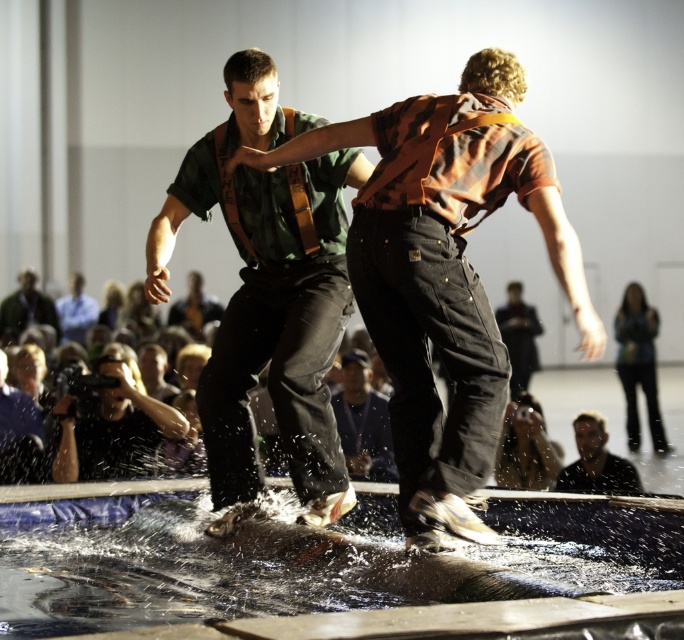
Is clear liquid water at center positioned behind orange cotton shirt at center?

No, clear liquid water at center is closer to the viewer.

Between point (586, 586) and point (434, 156), which one is positioned in front?

Point (434, 156)

Where is `clear liquid water at center`? clear liquid water at center is located at coordinates (330, 564).

Who is positioned more to the left, orange cotton shirt at center or smooth skin face at lower right?

From the viewer's perspective, orange cotton shirt at center appears more on the left side.

What do you see at coordinates (445, 273) in the screenshot? I see `orange cotton shirt at center` at bounding box center [445, 273].

I want to click on orange cotton shirt at center, so click(445, 273).

Looking at this image, which is more to the left, dark gray fabric pants at center or smooth skin face at lower right?

dark gray fabric pants at center

Is the position of dark gray fabric pants at center more distant than that of smooth skin face at lower right?

Yes, it is behind smooth skin face at lower right.

Locate an element on the screen. The image size is (684, 640). dark gray fabric pants at center is located at coordinates (363, 420).

Where is `dark gray fabric pants at center`? The image size is (684, 640). dark gray fabric pants at center is located at coordinates (363, 420).